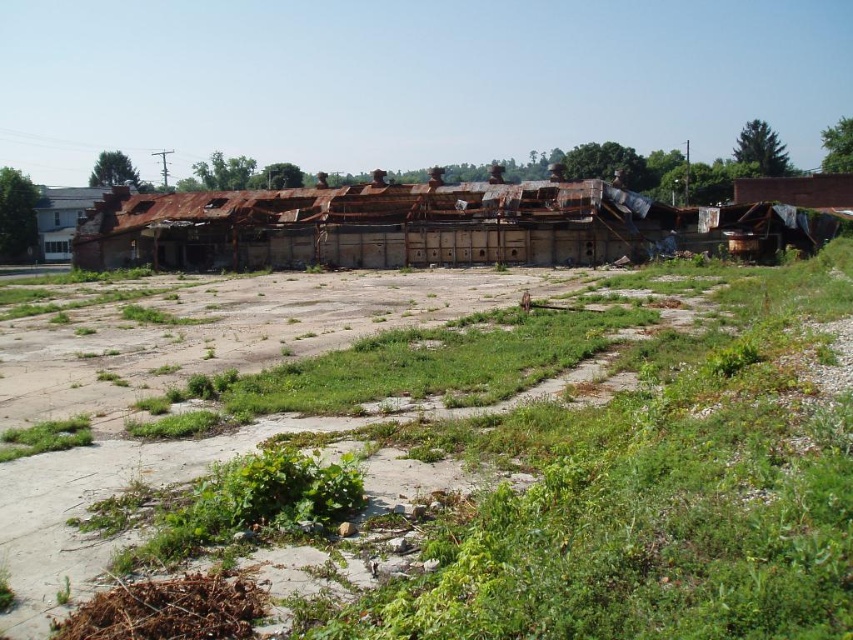
Question: Which object appears farthest from the camera in this image?

Choices:
 (A) rusty metal building at center
 (B) white painted wood house at left

Answer: (B)

Question: Which of these objects is positioned farthest from the green grass at center?

Choices:
 (A) rusty metal building at center
 (B) white painted wood house at left

Answer: (B)

Question: Is rusty metal building at center wider than white painted wood house at left?

Choices:
 (A) no
 (B) yes

Answer: (A)

Question: Considering the real-world distances, which object is farthest from the rusty metal building at center?

Choices:
 (A) green grass at center
 (B) white painted wood house at left

Answer: (A)

Question: Is green grass at center positioned in front of white painted wood house at left?

Choices:
 (A) yes
 (B) no

Answer: (A)

Question: Can you confirm if green grass at center is positioned to the right of rusty metal building at center?

Choices:
 (A) no
 (B) yes

Answer: (B)